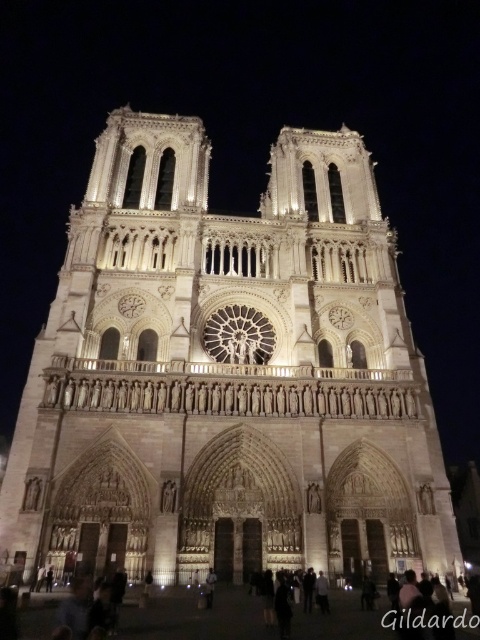
You are standing in front of the Notre Dame Cathedral at night. You see the light beige stone tower at center and the dark skin textured person at lower center. Which object is taller?

The light beige stone tower at center is taller than the dark skin textured person at lower center.

You are standing in front of the Notre Dame Cathedral at night. You see a point at location point (40, 552) and another at point (468, 612). Which point is closer to you?

Point (40, 552) is closer to you because it is further to the camera than point (468, 612).

You are standing in front of the Notre Dame Cathedral at night and see the light beige stone tower at center and the dark skin textured person at lower center. Which object is positioned higher in the image?

The light beige stone tower at center is positioned higher than the dark skin textured person at lower center in the image.